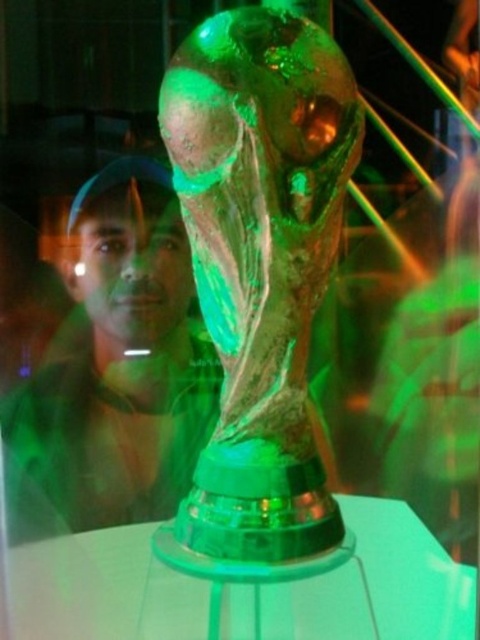
Question: Is matte black cap at upper left below transparent glass table at center?

Choices:
 (A) yes
 (B) no

Answer: (B)

Question: Is matte black cap at upper left further to the viewer compared to transparent glass table at center?

Choices:
 (A) no
 (B) yes

Answer: (B)

Question: Is matte black cap at upper left below transparent glass table at center?

Choices:
 (A) yes
 (B) no

Answer: (B)

Question: Which object is farther from the camera taking this photo?

Choices:
 (A) transparent glass table at center
 (B) matte black cap at upper left

Answer: (B)